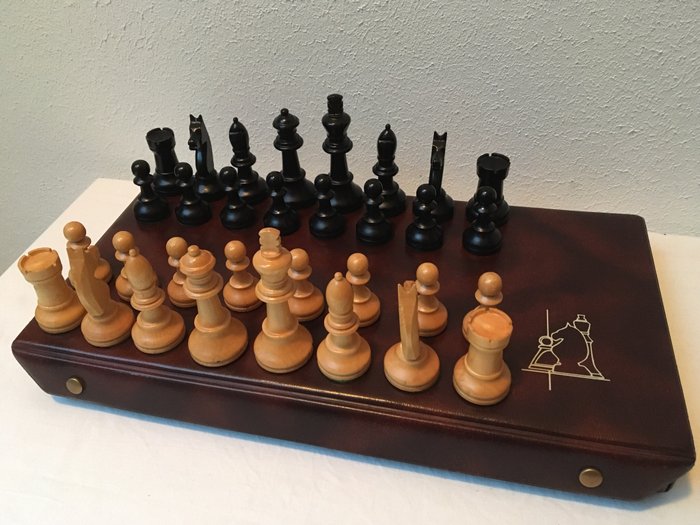
This screenshot has height=525, width=700. I want to click on table, so tap(96, 467).